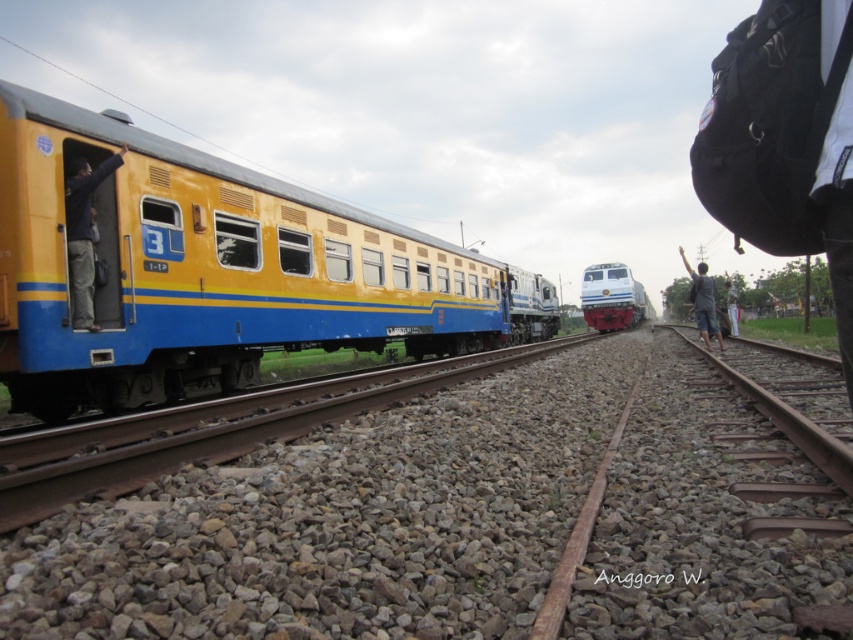
Does dark blue fabric jacket at left have a smaller size compared to white glossy locomotive at center?

Correct, dark blue fabric jacket at left occupies less space than white glossy locomotive at center.

Based on the photo, does dark blue fabric jacket at left appear on the left side of white glossy locomotive at center?

Correct, you'll find dark blue fabric jacket at left to the left of white glossy locomotive at center.

Identify the location of dark blue fabric jacket at left. (83, 232).

Does dark blue fabric jacket at left have a greater width compared to white cotton pants at right?

In fact, dark blue fabric jacket at left might be narrower than white cotton pants at right.

Does dark blue fabric jacket at left appear on the right side of white cotton pants at right?

Incorrect, dark blue fabric jacket at left is not on the right side of white cotton pants at right.

Does point (73, 323) come in front of point (735, 321)?

Yes, it is in front of point (735, 321).

The width and height of the screenshot is (853, 640). Find the location of `dark blue fabric jacket at left`. dark blue fabric jacket at left is located at coordinates (x=83, y=232).

Does yellow matte train car at left appear on the left side of dark blue fabric jacket at left?

Incorrect, yellow matte train car at left is not on the left side of dark blue fabric jacket at left.

Does point (373, 220) lie in front of point (94, 220)?

That is False.

This screenshot has height=640, width=853. Describe the element at coordinates (213, 272) in the screenshot. I see `yellow matte train car at left` at that location.

Locate an element on the screen. yellow matte train car at left is located at coordinates (213, 272).